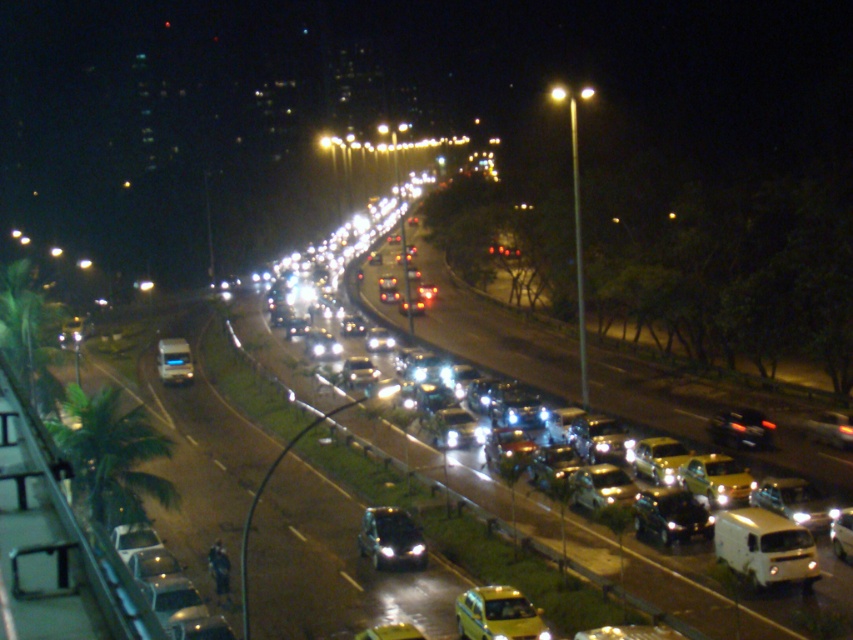
You are a pedestrian trying to cross the road at night. You see a yellow matte taxi at center and a metallic silver car at center. Which vehicle is shorter in height?

The yellow matte taxi at center is shorter in height compared to the metallic silver car at center.

You are a pedestrian trying to cross the highway at night. You see a yellow matte taxi at center and a shiny black suv at center. Which vehicle should you avoid stepping in front of because it is wider?

The shiny black suv at center is wider than the yellow matte taxi at center, so you should avoid stepping in front of the shiny black suv at center.

You are a delivery driver who needs to park your vehicle on the sidewalk next to the trees. The sidewalk can only accommodate vehicles narrower than 1.8 meters. You have a white matte van at lower right and a metallic silver car at center. Which vehicle can you park on the sidewalk?

The white matte van at lower right has a width less than the metallic silver car at center, so the white matte van at lower right can be parked on the sidewalk since it is narrower than 1.8 meters.